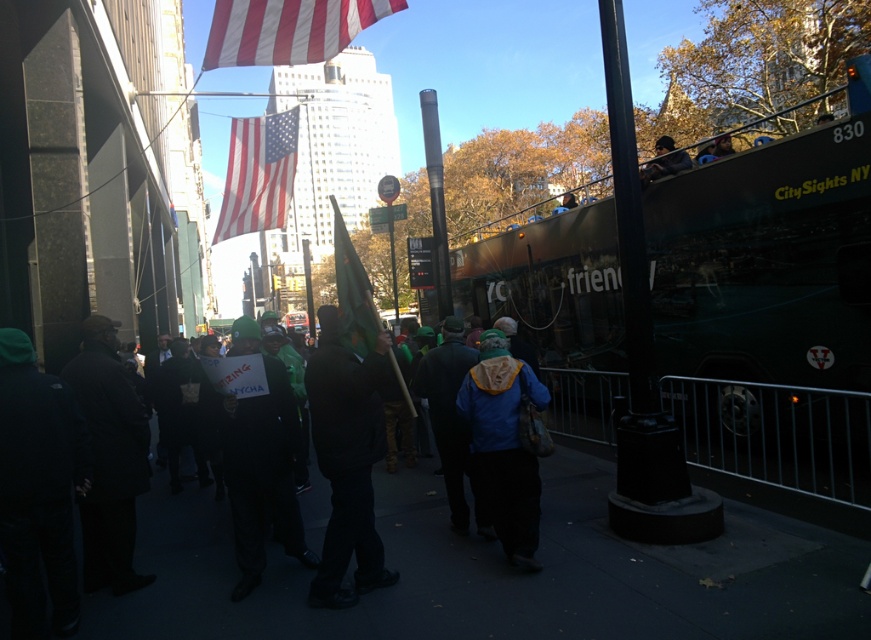
Does dark gray coat at left have a greater height compared to green fabric flag at center?

Correct, dark gray coat at left is much taller as green fabric flag at center.

Describe the element at coordinates (109, 458) in the screenshot. I see `dark gray coat at left` at that location.

Who is more distant from viewer, (120, 444) or (375, 342)?

Point (120, 444)

At what (x,y) coordinates should I click in order to perform the action: click on dark gray coat at left. Please return your answer as a coordinate pair (x, y). This screenshot has width=871, height=640. Looking at the image, I should click on (109, 458).

Describe the element at coordinates (262, 474) in the screenshot. I see `dark green fabric at center` at that location.

Does dark green fabric at center have a larger size compared to green fabric flag at center?

Incorrect, dark green fabric at center is not larger than green fabric flag at center.

Is point (253, 400) positioned in front of point (356, 355)?

No.

Identify the location of dark green fabric at center. The height and width of the screenshot is (640, 871). (262, 474).

Is black matte jacket at center positioned behind american flag at center?

No, it is in front of american flag at center.

Who is positioned more to the left, black matte jacket at center or american flag at center?

american flag at center

Does point (352, 397) come behind point (269, 141)?

That is False.

Locate an element on the screen. This screenshot has height=640, width=871. black matte jacket at center is located at coordinates pos(348,460).